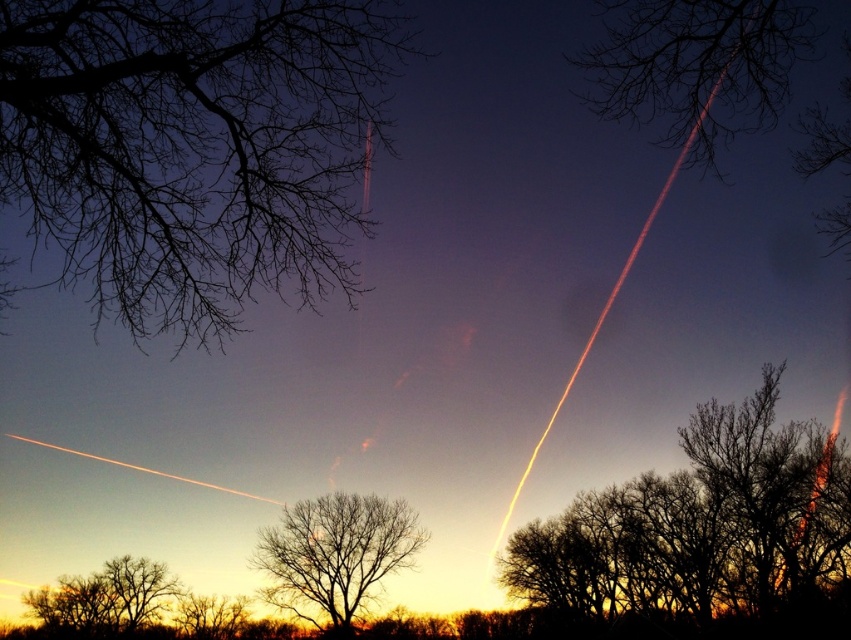
Question: Which of the following is the closest to the observer?

Choices:
 (A) silhouette bare tree at upper right
 (B) silhouette bare branches at upper left
 (C) bare branches at center
 (D) brown leafless tree at center

Answer: (A)

Question: Which is farther from the silhouette bare tree at upper right?

Choices:
 (A) bare branches at center
 (B) brown leafless tree at center
 (C) silhouette bare branches at upper left

Answer: (A)

Question: Is silhouette bare branches at upper left wider than bare branches at center?

Choices:
 (A) no
 (B) yes

Answer: (A)

Question: Which object is farther from the camera taking this photo?

Choices:
 (A) bare branches at center
 (B) silhouette bare tree at upper right
 (C) brown leafless tree at center
 (D) silhouette bare branches at upper left

Answer: (A)

Question: Does silhouette bare branches at upper left have a larger size compared to bare branches at center?

Choices:
 (A) yes
 (B) no

Answer: (B)

Question: Observing the image, what is the correct spatial positioning of brown leafless tree at center in reference to bare branches at center?

Choices:
 (A) left
 (B) right

Answer: (B)